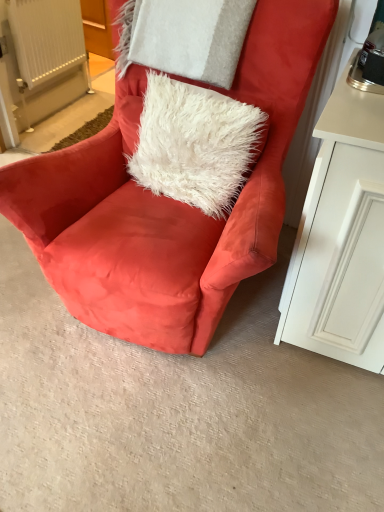
Question: From the image's perspective, is white plastic radiator at upper left on white fluffy pillow at upper center?

Choices:
 (A) yes
 (B) no

Answer: (A)

Question: Is white plastic radiator at upper left positioned far away from white fluffy pillow at upper center?

Choices:
 (A) no
 (B) yes

Answer: (B)

Question: Is white plastic radiator at upper left at the left side of white fluffy pillow at upper center?

Choices:
 (A) yes
 (B) no

Answer: (A)

Question: Considering the relative positions of white plastic radiator at upper left and white fluffy pillow at upper center in the image provided, is white plastic radiator at upper left to the right of white fluffy pillow at upper center from the viewer's perspective?

Choices:
 (A) yes
 (B) no

Answer: (B)

Question: Can you confirm if white plastic radiator at upper left is wider than white fluffy pillow at upper center?

Choices:
 (A) no
 (B) yes

Answer: (A)

Question: Is white fluffy pillow at upper center wider or thinner than suede orange chair at center?

Choices:
 (A) thin
 (B) wide

Answer: (A)

Question: From a real-world perspective, is white fluffy pillow at upper center above or below suede orange chair at center?

Choices:
 (A) below
 (B) above

Answer: (B)

Question: Is white fluffy pillow at upper center inside or outside of suede orange chair at center?

Choices:
 (A) outside
 (B) inside

Answer: (B)

Question: From the image's perspective, relative to suede orange chair at center, is white fluffy pillow at upper center above or below?

Choices:
 (A) above
 (B) below

Answer: (A)

Question: Relative to suede orange chair at center, is white fluffy pillow at upper center in front or behind?

Choices:
 (A) front
 (B) behind

Answer: (B)

Question: Looking at their shapes, would you say white fluffy pillow at upper center is wider or thinner than suede orange chair at center?

Choices:
 (A) thin
 (B) wide

Answer: (A)

Question: Would you say white fluffy pillow at upper center is to the left or to the right of suede orange chair at center in the picture?

Choices:
 (A) left
 (B) right

Answer: (B)

Question: Is white fluffy pillow at upper center bigger or smaller than suede orange chair at center?

Choices:
 (A) small
 (B) big

Answer: (A)

Question: Based on their positions, is white fluffy pillow at upper center located to the left or right of white plastic radiator at upper left?

Choices:
 (A) left
 (B) right

Answer: (B)

Question: From the image's perspective, is white fluffy pillow at upper center located above or below white plastic radiator at upper left?

Choices:
 (A) below
 (B) above

Answer: (A)